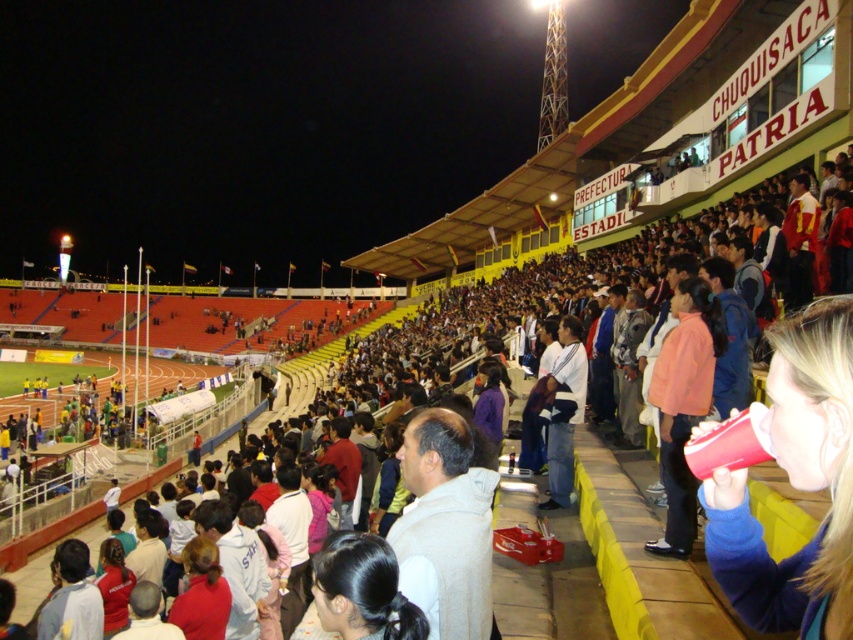
Between matte red cup at lower right and white cotton shirt at center, which one is positioned higher?

white cotton shirt at center

Is point (740, 593) positioned in front of point (550, 419)?

Yes, point (740, 593) is closer to viewer.

Is point (827, 589) closer to viewer compared to point (560, 477)?

Yes, it is.

Locate an element on the screen. matte red cup at lower right is located at coordinates (795, 483).